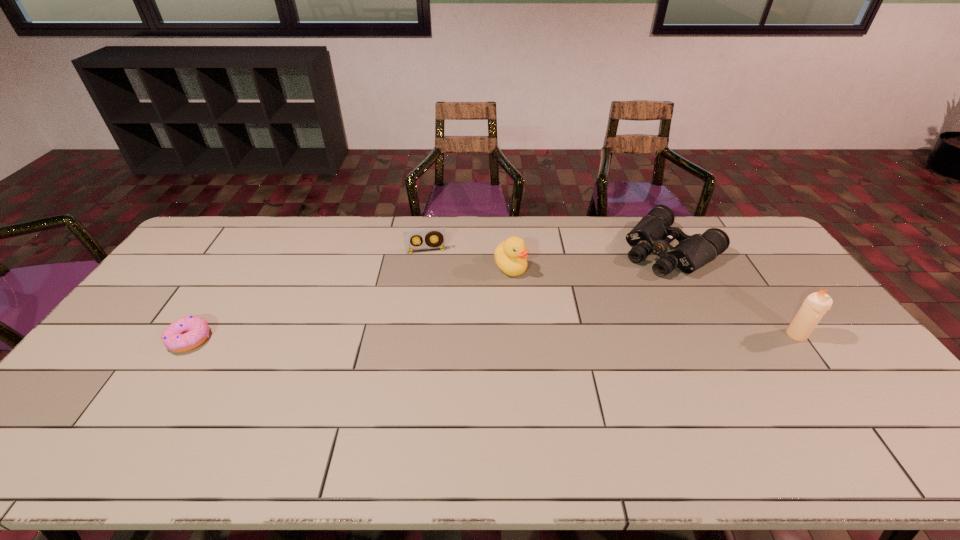
You are a GUI agent. You are given a task and a screenshot of the screen. Output one action in this format:
    pyautogui.click(x=<x>, y=<y>)
    Task: Click on the videotape positioned at the far edge
    The width and height of the screenshot is (960, 540).
    Given the screenshot: What is the action you would take?
    pyautogui.click(x=410, y=236)

Where is `duck present at the far edge`? This screenshot has height=540, width=960. duck present at the far edge is located at coordinates (510, 255).

The image size is (960, 540). I want to click on object that is at the left edge, so click(x=186, y=333).

Locate an element on the screen. object located at the right edge is located at coordinates (815, 305).

Locate an element on the screen. The image size is (960, 540). free space at the far edge of the desktop is located at coordinates click(x=377, y=218).

The image size is (960, 540). In the image, there is a desktop. In order to click on vacant space at the near edge in this screenshot , I will do `click(167, 400)`.

Where is `vacant area at the left edge`? vacant area at the left edge is located at coordinates (161, 336).

Locate an element on the screen. The image size is (960, 540). vacant space at the right edge of the desktop is located at coordinates (787, 285).

In the image, there is a desktop. Where is `free space at the far left corner`? The height and width of the screenshot is (540, 960). free space at the far left corner is located at coordinates (244, 228).

You are a GUI agent. You are given a task and a screenshot of the screen. Output one action in this format:
    pyautogui.click(x=<x>, y=<y>)
    Task: Click on the free region at the near right corner of the desktop
    The image size is (960, 540).
    Given the screenshot: What is the action you would take?
    pyautogui.click(x=857, y=406)